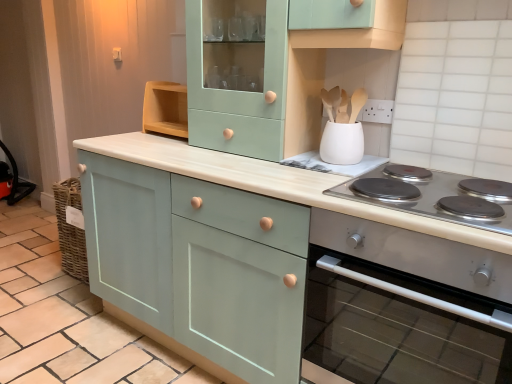
Find the location of `vacant space to the left of mint green wood cabinet at upper center, acting as the 2th cabinetry starting from the left`. vacant space to the left of mint green wood cabinet at upper center, acting as the 2th cabinetry starting from the left is located at coordinates (152, 148).